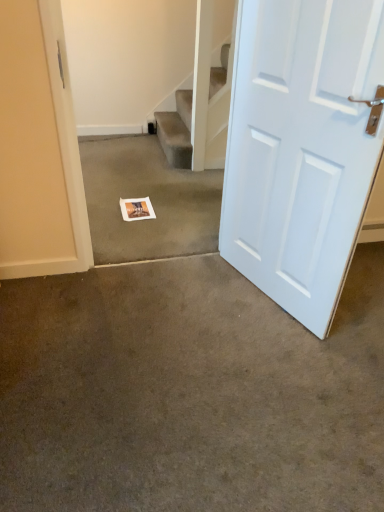
Question: Can you confirm if white paper postcard at center is positioned to the right of white paper at center, the 2th concrete positioned from the bottom?

Choices:
 (A) yes
 (B) no

Answer: (B)

Question: Is white paper postcard at center facing towards white paper at center, the 2th concrete positioned from the bottom?

Choices:
 (A) yes
 (B) no

Answer: (A)

Question: Considering the relative sizes of white paper postcard at center and white paper at center, which is counted as the 1th concrete, starting from the back, in the image provided, is white paper postcard at center smaller than white paper at center, which is counted as the 1th concrete, starting from the back,?

Choices:
 (A) no
 (B) yes

Answer: (B)

Question: Does white paper postcard at center have a larger size compared to white paper at center, which is counted as the 1th concrete, starting from the back?

Choices:
 (A) no
 (B) yes

Answer: (A)

Question: Considering the relative sizes of white paper postcard at center and white paper at center, which appears as the 2th concrete when viewed from the front, in the image provided, is white paper postcard at center shorter than white paper at center, which appears as the 2th concrete when viewed from the front,?

Choices:
 (A) yes
 (B) no

Answer: (A)

Question: From the image's perspective, is white paper postcard at center beneath white paper at center, which appears as the 2th concrete when viewed from the front?

Choices:
 (A) yes
 (B) no

Answer: (A)

Question: Is brown carpet at center, acting as the first concrete starting from the front, located outside white paper at center, which appears as the 2th concrete when viewed from the front?

Choices:
 (A) no
 (B) yes

Answer: (B)

Question: Considering the relative sizes of brown carpet at center, marked as the first concrete in a bottom-to-top arrangement, and white paper at center, which is counted as the 1th concrete, starting from the back, in the image provided, is brown carpet at center, marked as the first concrete in a bottom-to-top arrangement, smaller than white paper at center, which is counted as the 1th concrete, starting from the back,?

Choices:
 (A) no
 (B) yes

Answer: (B)

Question: From a real-world perspective, is brown carpet at center, acting as the first concrete starting from the front, over white paper at center, which is counted as the 1th concrete, starting from the back?

Choices:
 (A) yes
 (B) no

Answer: (B)

Question: Considering the relative sizes of brown carpet at center, marked as the first concrete in a bottom-to-top arrangement, and white paper at center, which appears as the 2th concrete when viewed from the front, in the image provided, is brown carpet at center, marked as the first concrete in a bottom-to-top arrangement, thinner than white paper at center, which appears as the 2th concrete when viewed from the front,?

Choices:
 (A) yes
 (B) no

Answer: (A)

Question: Does brown carpet at center, arranged as the second concrete when viewed from the back, come in front of white paper at center, which is counted as the 1th concrete, starting from the back?

Choices:
 (A) yes
 (B) no

Answer: (A)

Question: Does brown carpet at center, arranged as the second concrete when viewed from the back, come behind white paper at center, which appears as the 2th concrete when viewed from the front?

Choices:
 (A) yes
 (B) no

Answer: (B)

Question: Is white paper postcard at center at the left side of brown carpet at center, marked as the first concrete in a bottom-to-top arrangement?

Choices:
 (A) no
 (B) yes

Answer: (B)